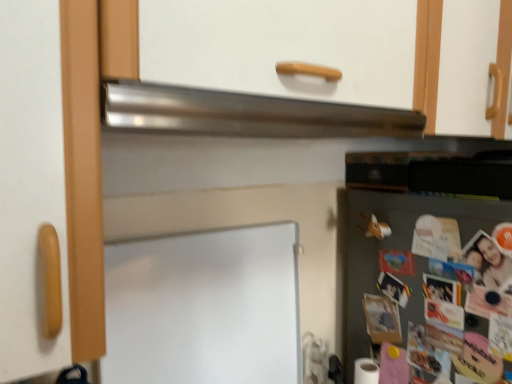
Question: Should I look upward or downward to see green matte fridge at lower right?

Choices:
 (A) down
 (B) up

Answer: (A)

Question: Can you see green matte fridge at lower right touching white matte board at center?

Choices:
 (A) no
 (B) yes

Answer: (A)

Question: Is green matte fridge at lower right thinner than white matte board at center?

Choices:
 (A) no
 (B) yes

Answer: (A)

Question: Is white matte board at center a part of green matte fridge at lower right?

Choices:
 (A) yes
 (B) no

Answer: (B)

Question: Can you confirm if green matte fridge at lower right is positioned to the right of white matte board at center?

Choices:
 (A) yes
 (B) no

Answer: (A)

Question: Would you consider green matte fridge at lower right to be distant from white matte board at center?

Choices:
 (A) yes
 (B) no

Answer: (B)

Question: From a real-world perspective, is green matte fridge at lower right below white matte board at center?

Choices:
 (A) yes
 (B) no

Answer: (A)

Question: Does satin metallic exhaust hood at upper center have a smaller size compared to green matte fridge at lower right?

Choices:
 (A) no
 (B) yes

Answer: (B)

Question: From the image's perspective, is satin metallic exhaust hood at upper center over green matte fridge at lower right?

Choices:
 (A) yes
 (B) no

Answer: (A)

Question: From a real-world perspective, is satin metallic exhaust hood at upper center located higher than green matte fridge at lower right?

Choices:
 (A) yes
 (B) no

Answer: (A)

Question: Is satin metallic exhaust hood at upper center surrounding green matte fridge at lower right?

Choices:
 (A) yes
 (B) no

Answer: (B)

Question: From a real-world perspective, is satin metallic exhaust hood at upper center located beneath green matte fridge at lower right?

Choices:
 (A) yes
 (B) no

Answer: (B)

Question: Is the depth of satin metallic exhaust hood at upper center less than that of green matte fridge at lower right?

Choices:
 (A) yes
 (B) no

Answer: (A)

Question: Does satin metallic exhaust hood at upper center have a greater width compared to white matte board at center?

Choices:
 (A) no
 (B) yes

Answer: (B)